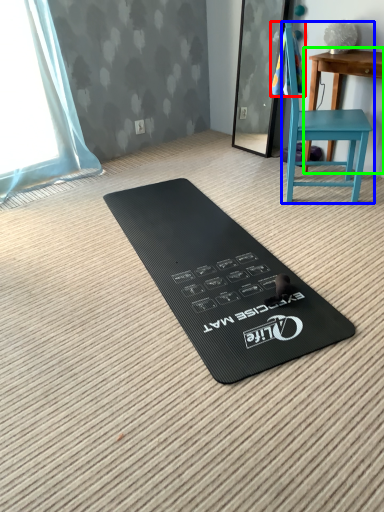
Question: Considering the real-world distances, which object is farthest from beach towel (highlighted by a red box)? chair (highlighted by a blue box) or table (highlighted by a green box)?

Choices:
 (A) chair
 (B) table

Answer: (A)